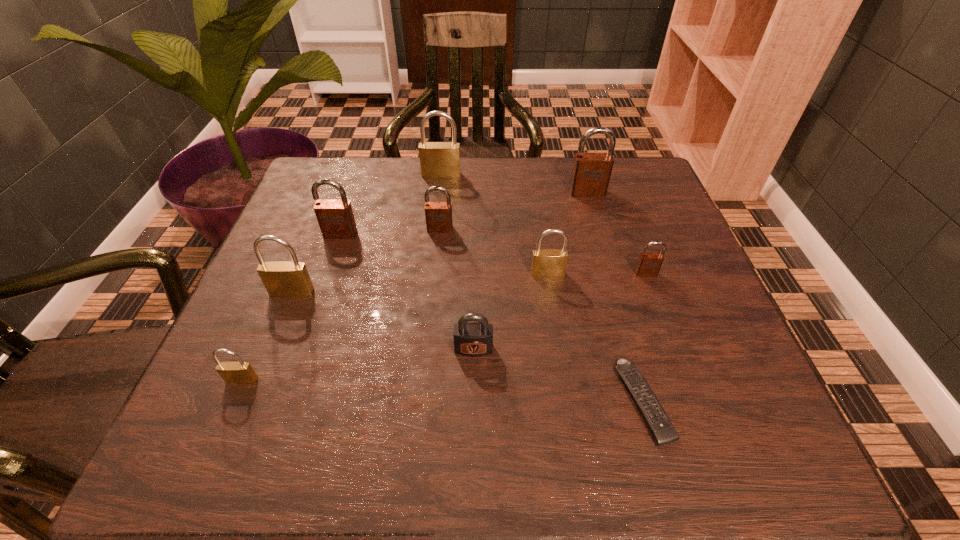
Locate an element on the screen. This screenshot has width=960, height=540. gray padlock is located at coordinates (470, 339).

Find the location of a particular element. the sixth padlock from left to right is located at coordinates (470, 339).

Identify the location of the nearest padlock. (240, 372).

Locate an element on the screen. This screenshot has height=540, width=960. the smallest brass padlock is located at coordinates [x=240, y=372].

Where is `the rightmost brown padlock`? The width and height of the screenshot is (960, 540). the rightmost brown padlock is located at coordinates (649, 263).

Find the location of a particular element. This screenshot has width=960, height=540. the rightmost object is located at coordinates coord(649,263).

You are a GUI agent. You are given a task and a screenshot of the screen. Output one action in this format:
    pyautogui.click(x=<x>, y=<y>)
    Task: Click on the shortest object
    
    Given the screenshot: What is the action you would take?
    pyautogui.click(x=663, y=431)

Locate an element on the screen. Image resolution: width=960 pixels, height=540 pixels. vacant region located on the front-facing side of the farthest object is located at coordinates (431, 271).

Where is `vacant area situated on the front-facing side of the second brown padlock from right to left`? vacant area situated on the front-facing side of the second brown padlock from right to left is located at coordinates (595, 219).

Find the location of a particular element. This screenshot has width=960, height=540. blank area located 0.270m on the front-facing side of the third farthest brass padlock is located at coordinates (239, 425).